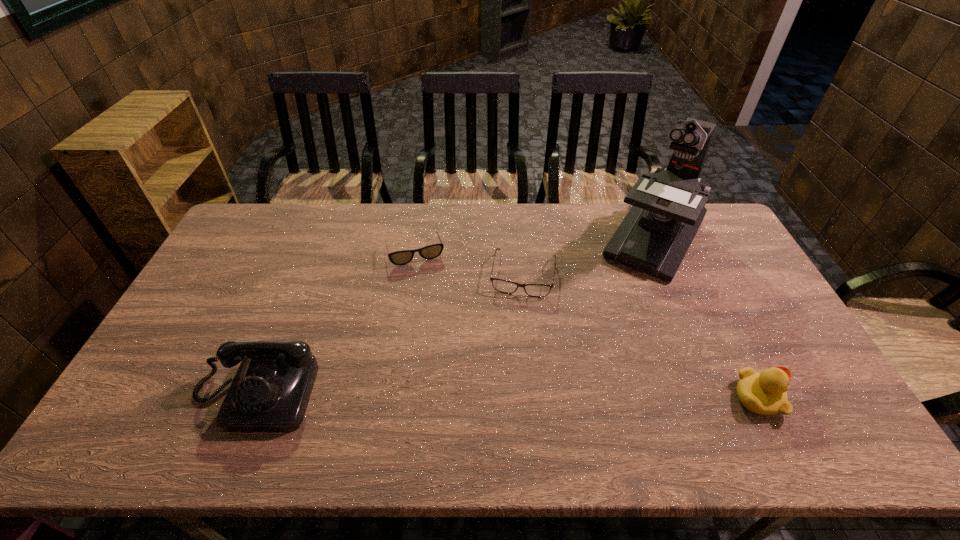
You are a GUI agent. You are given a task and a screenshot of the screen. Output one action in this format:
    pyautogui.click(x=<x>, y=<y>)
    Task: Click on the free spot on the desktop that is between the leftmost object and the third tallest object and is positioned on the lenses of the third object from right to left
    This screenshot has height=540, width=960.
    Given the screenshot: What is the action you would take?
    pyautogui.click(x=504, y=396)

The height and width of the screenshot is (540, 960). In order to click on free spot on the desktop that is between the leftmost object and the duckling and is positioned through the eyepieces of the tallest object in this screenshot , I will do `click(557, 396)`.

I want to click on free spot on the desktop that is between the telephone and the duckling and is positioned on the front-facing side of the sunglasses, so click(458, 396).